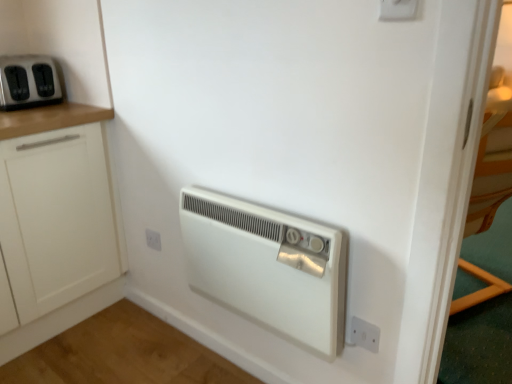
Question: Is white plastic electric outlet at lower center, the 3th electric outlet in the front-to-back sequence, bigger or smaller than matte black toaster at upper left, positioned as the 2th home appliance in right-to-left order?

Choices:
 (A) big
 (B) small

Answer: (B)

Question: Considering the relative positions of white plastic electric outlet at lower center, which ranks as the 2th electric outlet in bottom-to-top order, and matte black toaster at upper left, arranged as the 1th home appliance when viewed from the back, in the image provided, is white plastic electric outlet at lower center, which ranks as the 2th electric outlet in bottom-to-top order, to the left or to the right of matte black toaster at upper left, arranged as the 1th home appliance when viewed from the back,?

Choices:
 (A) left
 (B) right

Answer: (B)

Question: Estimate the real-world distances between objects in this image. Which object is farther from the white plastic electric outlet at lower right, the 2th electric outlet when ordered from front to back?

Choices:
 (A) matte black toaster at upper left, acting as the 1th home appliance starting from the left
 (B) white plastic electric outlet at upper right, which is the 2th electric outlet in right-to-left order
 (C) white matte cabinet at left
 (D) white plastic electric outlet at lower center, acting as the second electric outlet starting from the top
 (E) white plastic heater at center, placed as the second home appliance when sorted from left to right

Answer: (A)

Question: Based on their relative distances, which object is farther from the white plastic electric outlet at lower center, which ranks as the 2th electric outlet in bottom-to-top order?

Choices:
 (A) white plastic electric outlet at lower right, which ranks as the third electric outlet in left-to-right order
 (B) white plastic heater at center, which appears as the first home appliance when viewed from the front
 (C) white matte cabinet at left
 (D) matte black toaster at upper left, acting as the 2th home appliance starting from the front
 (E) white plastic electric outlet at upper right, the first electric outlet positioned from the front

Answer: (E)